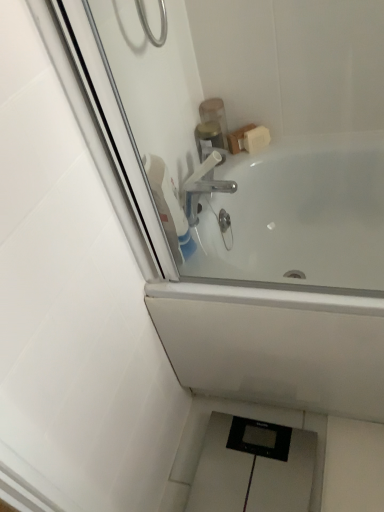
Question: Is translucent plastic soap dispenser at upper center, positioned as the second toiletry in bottom-to-top order, in contact with translucent plastic container at upper center, positioned as the second toiletry in top-to-bottom order?

Choices:
 (A) yes
 (B) no

Answer: (A)

Question: Is translucent plastic soap dispenser at upper center, placed as the 1th toiletry when sorted from top to bottom, not within translucent plastic container at upper center, the 1th toiletry positioned from the bottom?

Choices:
 (A) no
 (B) yes

Answer: (B)

Question: From a real-world perspective, is translucent plastic soap dispenser at upper center, positioned as the second toiletry in bottom-to-top order, over translucent plastic container at upper center, the 1th toiletry positioned from the bottom?

Choices:
 (A) yes
 (B) no

Answer: (A)

Question: Is translucent plastic soap dispenser at upper center, positioned as the second toiletry in bottom-to-top order, oriented towards translucent plastic container at upper center, the 1th toiletry positioned from the bottom?

Choices:
 (A) no
 (B) yes

Answer: (A)

Question: Can you confirm if translucent plastic soap dispenser at upper center, placed as the 1th toiletry when sorted from top to bottom, is wider than translucent plastic container at upper center, positioned as the second toiletry in top-to-bottom order?

Choices:
 (A) yes
 (B) no

Answer: (A)

Question: Does translucent plastic soap dispenser at upper center, placed as the 1th toiletry when sorted from top to bottom, have a lesser width compared to translucent plastic container at upper center, the 1th toiletry positioned from the bottom?

Choices:
 (A) no
 (B) yes

Answer: (A)

Question: Does white plastic tap at upper center lie in front of translucent plastic container at upper center, positioned as the second toiletry in top-to-bottom order?

Choices:
 (A) no
 (B) yes

Answer: (B)

Question: Is white plastic tap at upper center bigger than translucent plastic container at upper center, positioned as the second toiletry in top-to-bottom order?

Choices:
 (A) no
 (B) yes

Answer: (B)

Question: From the image's perspective, is white plastic tap at upper center over translucent plastic container at upper center, the 1th toiletry positioned from the bottom?

Choices:
 (A) no
 (B) yes

Answer: (A)

Question: From a real-world perspective, is white plastic tap at upper center positioned under translucent plastic container at upper center, positioned as the second toiletry in top-to-bottom order, based on gravity?

Choices:
 (A) no
 (B) yes

Answer: (A)

Question: Does white plastic tap at upper center appear on the left side of translucent plastic container at upper center, positioned as the second toiletry in top-to-bottom order?

Choices:
 (A) yes
 (B) no

Answer: (A)

Question: Would you say translucent plastic container at upper center, the 1th toiletry positioned from the bottom, is part of white plastic tap at upper center's contents?

Choices:
 (A) yes
 (B) no

Answer: (B)

Question: From a real-world perspective, is polished chrome faucet at upper center positioned under translucent plastic container at upper center, positioned as the second toiletry in top-to-bottom order, based on gravity?

Choices:
 (A) no
 (B) yes

Answer: (B)